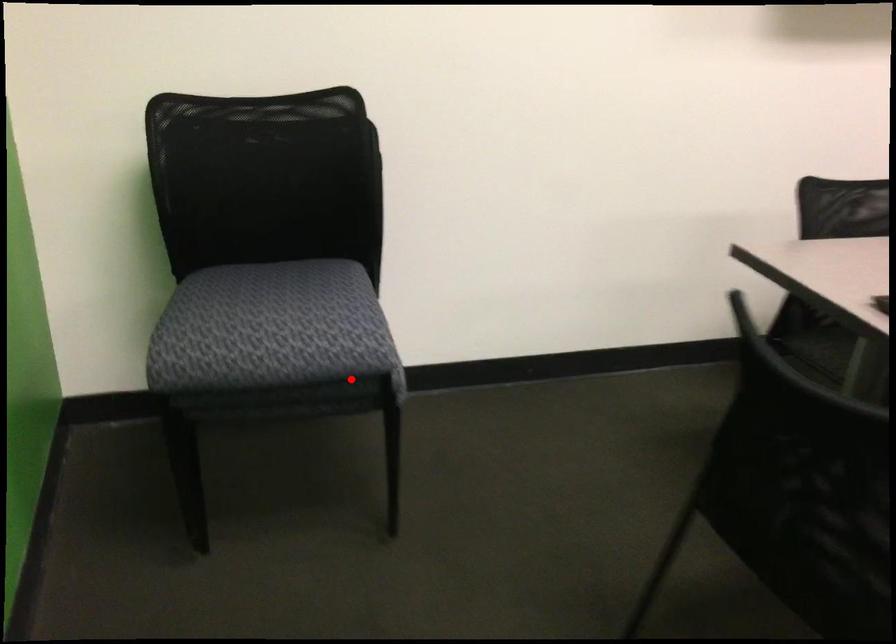
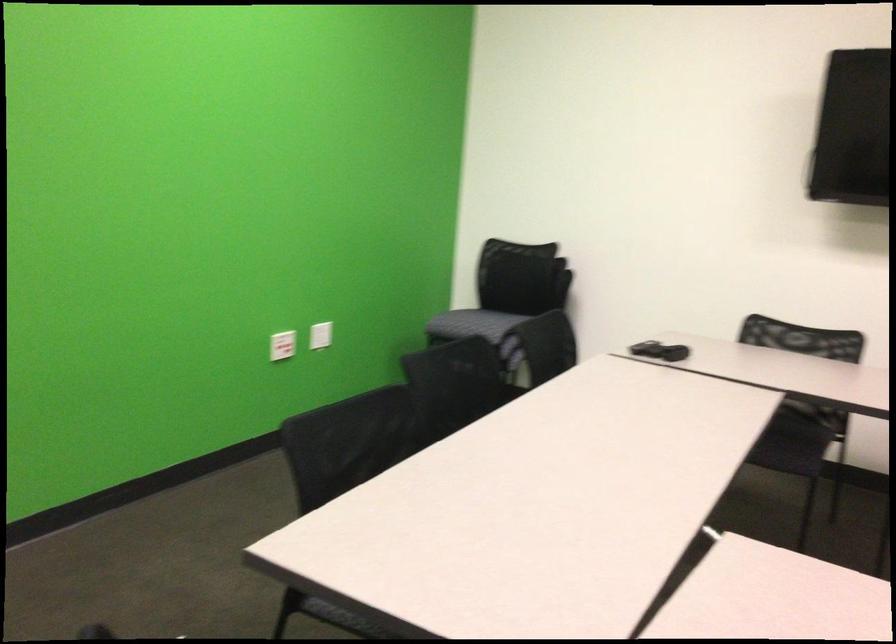
Locate, in the second image, the point that corresponds to the highlighted location in the first image.

(471, 324)